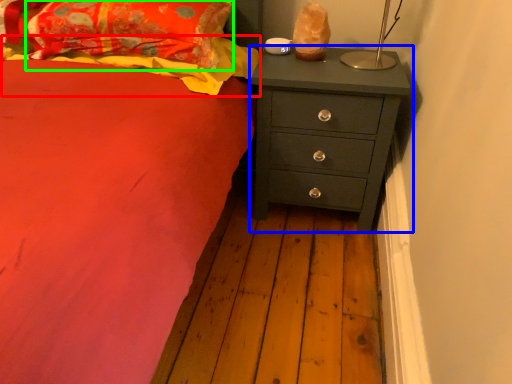
Question: Based on their relative distances, which object is farther from blanket (highlighted by a red box)? Choose from chest of drawers (highlighted by a blue box) and pillow (highlighted by a green box).

Choices:
 (A) chest of drawers
 (B) pillow

Answer: (A)